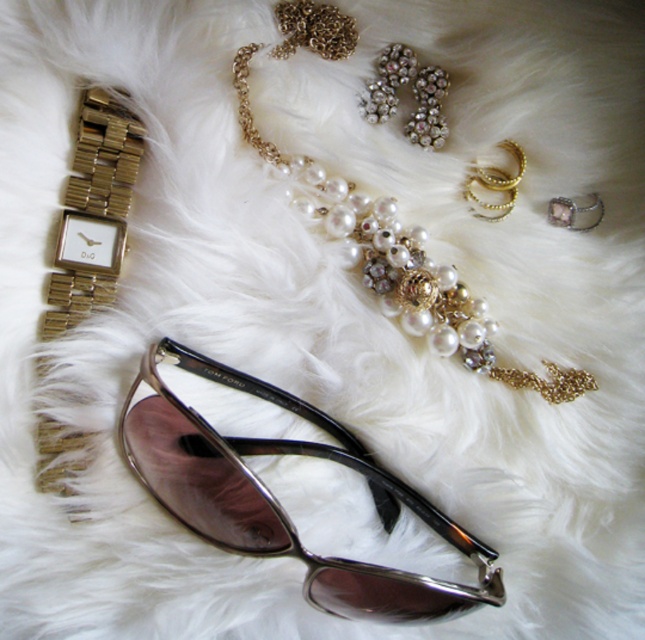
Who is positioned more to the right, pearl and gold chain at upper center or gold metallic watch at left?

Positioned to the right is pearl and gold chain at upper center.

Does pearl and gold chain at upper center appear on the left side of gold metallic watch at left?

In fact, pearl and gold chain at upper center is to the right of gold metallic watch at left.

This screenshot has width=645, height=640. What do you see at coordinates (402, 264) in the screenshot?
I see `pearl and gold chain at upper center` at bounding box center [402, 264].

Locate an element on the screen. This screenshot has height=640, width=645. pearl and gold chain at upper center is located at coordinates (402, 264).

Does metallic/smooth sunglasses at center appear over clear crystal ring at center?

Actually, metallic/smooth sunglasses at center is below clear crystal ring at center.

Can you confirm if metallic/smooth sunglasses at center is shorter than clear crystal ring at center?

In fact, metallic/smooth sunglasses at center may be taller than clear crystal ring at center.

Find the location of `metallic/smooth sunglasses at center`. metallic/smooth sunglasses at center is located at coordinates (275, 499).

Between point (106, 292) and point (577, 227), which one is positioned behind?

Point (577, 227)

Where is `gold metallic watch at left`? gold metallic watch at left is located at coordinates (94, 211).

The image size is (645, 640). I want to click on gold metallic watch at left, so click(x=94, y=211).